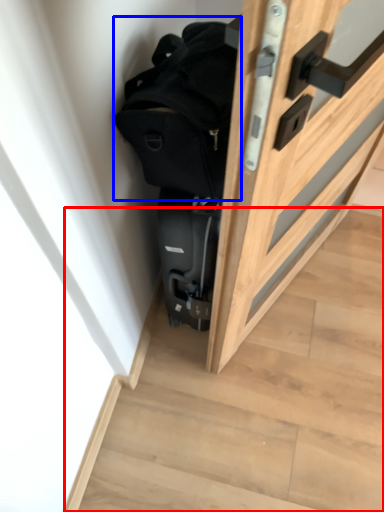
Question: Which of the following is the closest to the observer, stairwell (highlighted by a red box) or backpack (highlighted by a blue box)?

Choices:
 (A) stairwell
 (B) backpack

Answer: (B)